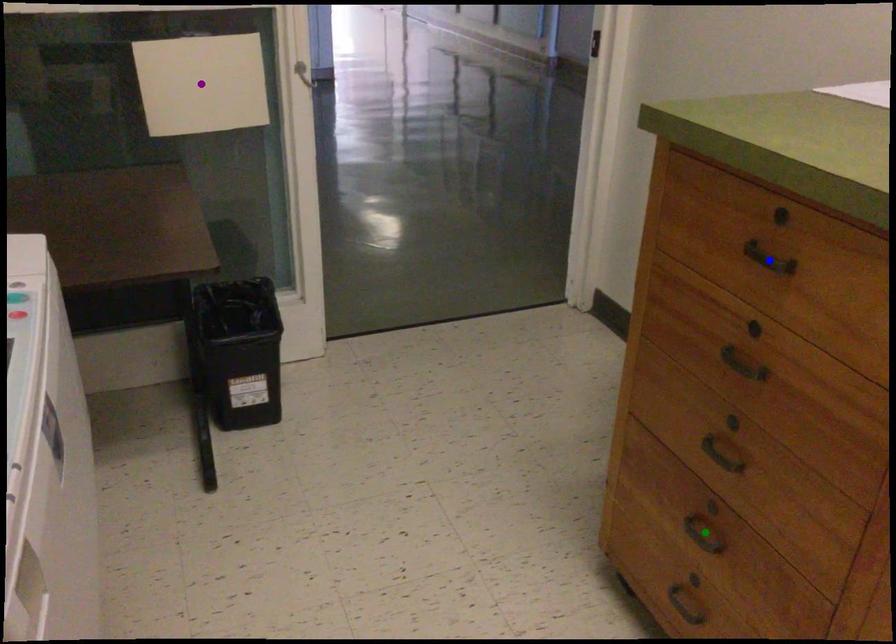
Order these from nearest to farthest:
- purple point
- green point
- blue point

blue point < green point < purple point